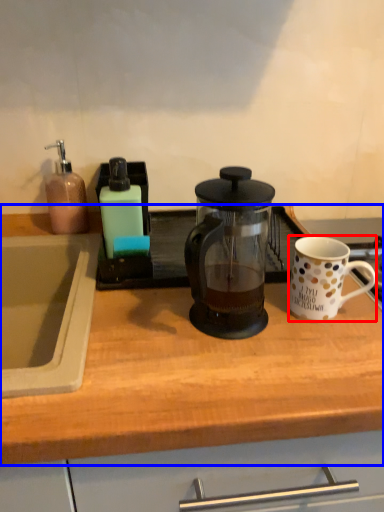
Question: Among these objects, which one is nearest to the camera, coffee cup (highlighted by a red box) or countertop (highlighted by a blue box)?

Choices:
 (A) coffee cup
 (B) countertop

Answer: (B)